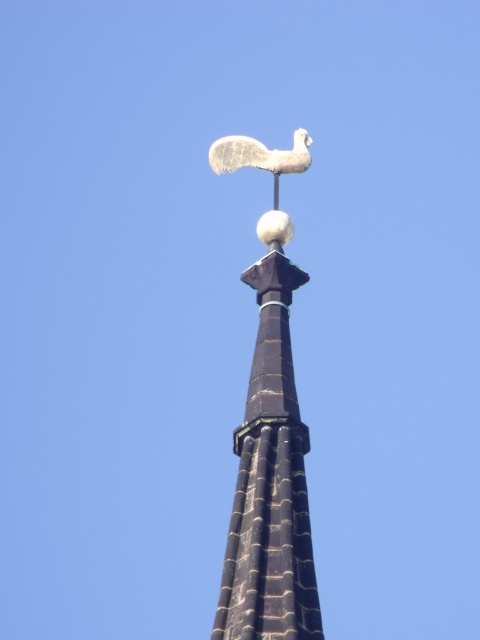
Question: Is the position of black stone spire at upper center less distant than that of white stone bird at upper center?

Choices:
 (A) yes
 (B) no

Answer: (A)

Question: Is black stone spire at upper center further to camera compared to white stone bird at upper center?

Choices:
 (A) no
 (B) yes

Answer: (A)

Question: Which object is farther from the camera taking this photo?

Choices:
 (A) white stone bird at upper center
 (B) black stone spire at upper center

Answer: (A)

Question: Does black stone spire at upper center appear under white stone bird at upper center?

Choices:
 (A) yes
 (B) no

Answer: (A)